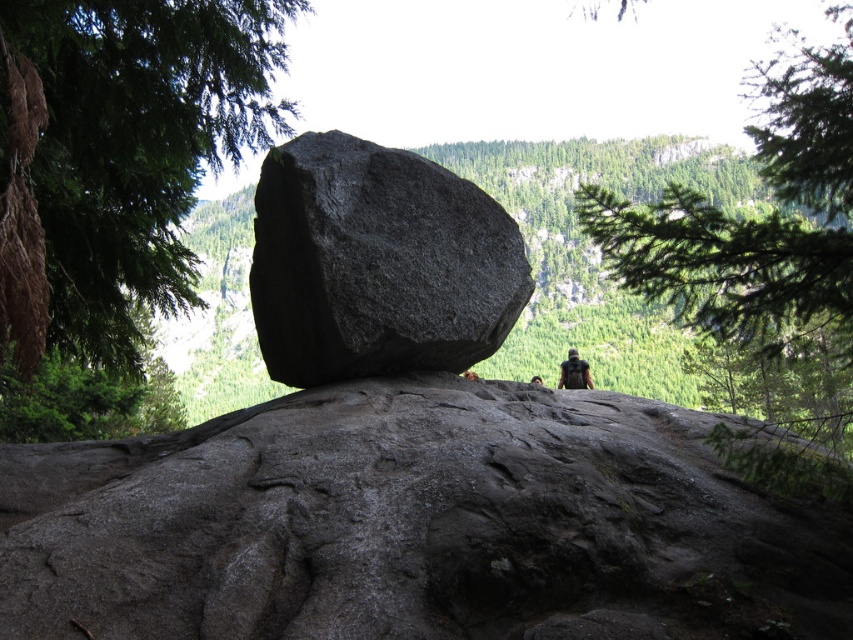
Does green leafy tree at upper left have a lesser width compared to green leafy branch at upper right?

Indeed, green leafy tree at upper left has a lesser width compared to green leafy branch at upper right.

Describe the element at coordinates (119, 154) in the screenshot. I see `green leafy tree at upper left` at that location.

Identify the location of green leafy tree at upper left. The height and width of the screenshot is (640, 853). (119, 154).

Is point (305, 381) less distant than point (535, 380)?

That is True.

Who is lower down, dark gray granite boulder at center or brown leather backpack at center?

brown leather backpack at center is below.

Does point (303, 369) come behind point (532, 376)?

No, (303, 369) is closer to viewer.

Find the location of a particular element. The height and width of the screenshot is (640, 853). dark gray granite boulder at center is located at coordinates (376, 262).

Who is positioned more to the left, green leafy tree at upper left or brown leather backpack at center?

green leafy tree at upper left is more to the left.

Is green leafy tree at upper left taller than brown leather backpack at center?

Correct, green leafy tree at upper left is much taller as brown leather backpack at center.

Who is more forward, (32, 99) or (531, 380)?

Point (32, 99) is more forward.

At what (x,y) coordinates should I click in order to perform the action: click on green leafy tree at upper left. Please return your answer as a coordinate pair (x, y). Looking at the image, I should click on (119, 154).